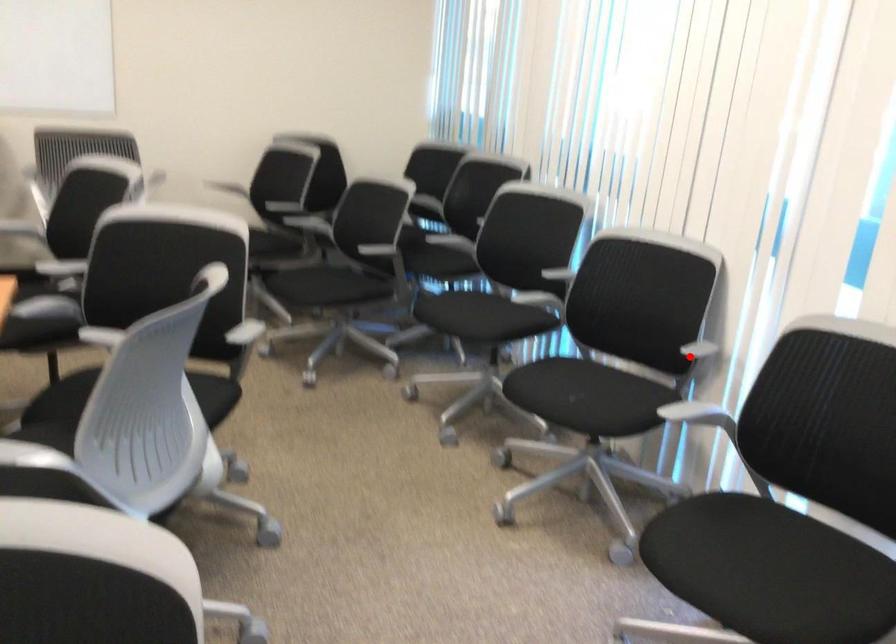
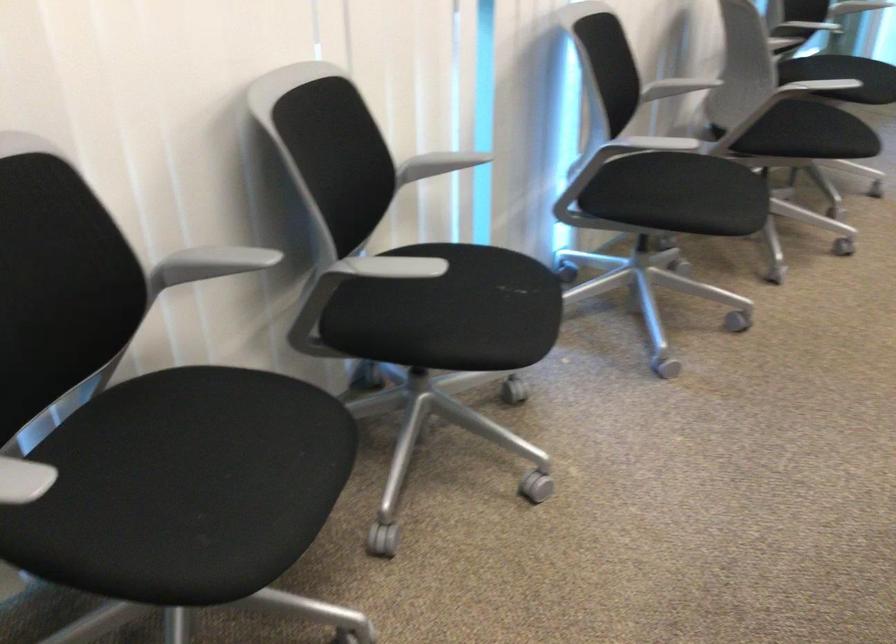
Where in the second image is the point corresponding to the highlighted location from the first image?

(438, 164)